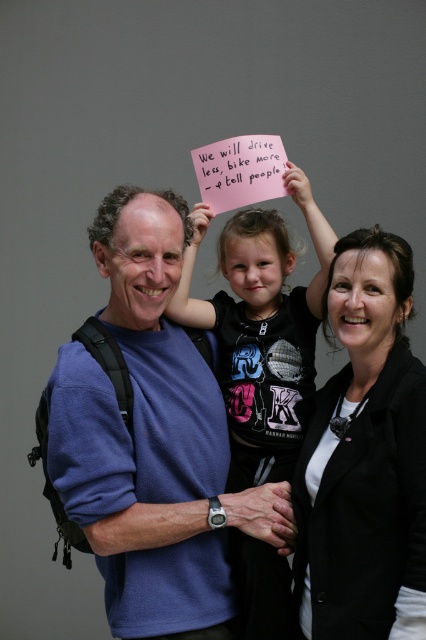
You are standing at the point with coordinates point (155, 323) and want to see the point with coordinates point (342, 536). Can you see it directly without moving?

No, because point (155, 323) is behind point (342, 536), so it blocks the view.

You are a photographer setting up a shoot. You need to place a microphone between the black matte blazer at center and the black matte shirt at center so that it is equidistant from both. However, you realize the blazer is closer to you than the shirt. Where should you position the microphone to ensure it is equidistant from both objects?

Since the black matte blazer at center is closer to the viewer than the black matte shirt at center, you should position the microphone closer to the black matte shirt at center. This way, the distance from the microphone to both the blazer and the shirt will be equal.

You are a photographer who needs to adjust the lighting to ensure both the black matte blazer at center and the black matte shirt at center are clearly visible. Since they are both black, how can you use their positions to help differentiate them in the photo?

The black matte blazer at center is to the right of the black matte shirt at center. By angling the light source so that it highlights the right side more, the blazer will appear brighter than the shirt, making them distinguishable.